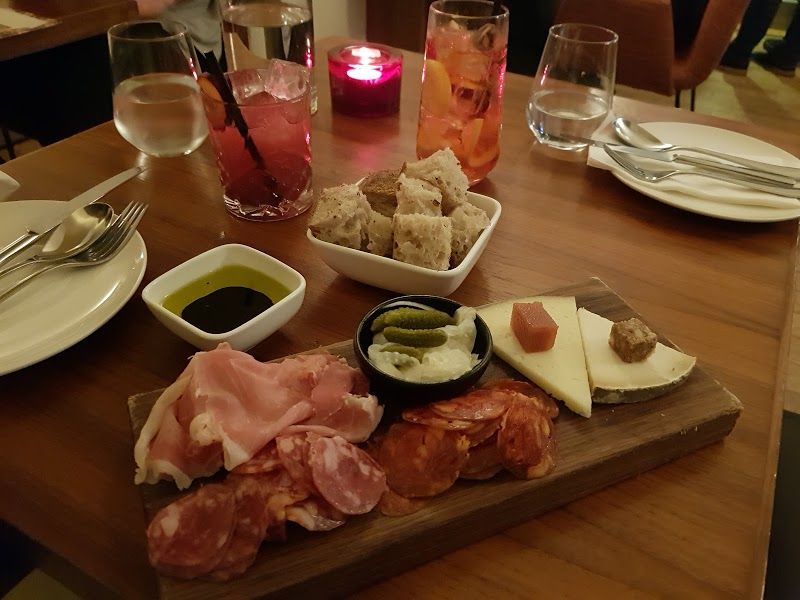
You are a GUI agent. You are given a task and a screenshot of the screen. Output one action in this format:
    pyautogui.click(x=<x>, y=<y>)
    Task: Click on the bowl of bread cubes
    The width and height of the screenshot is (800, 600).
    Given the screenshot: What is the action you would take?
    pyautogui.click(x=386, y=249)